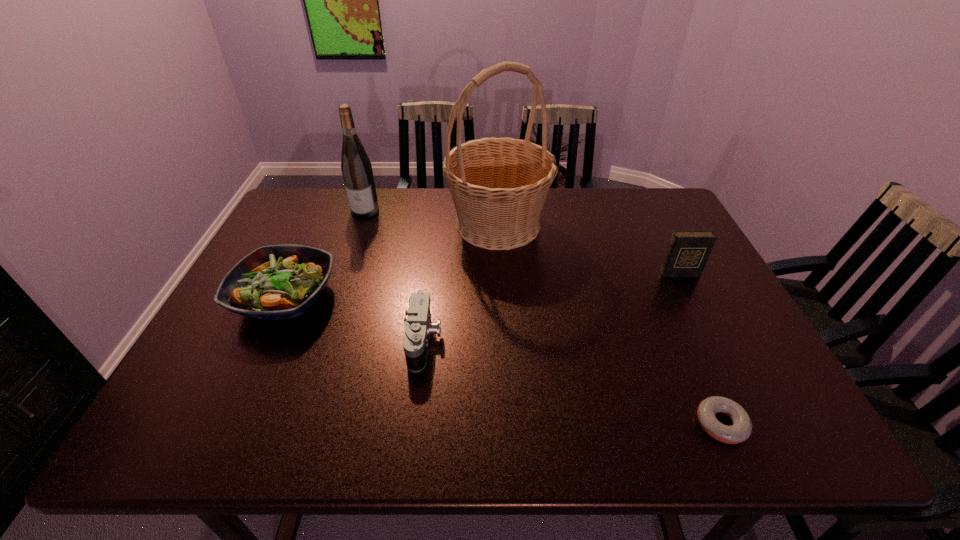
Where is `free area in between the shortest object and the fifth shortest object`? The height and width of the screenshot is (540, 960). free area in between the shortest object and the fifth shortest object is located at coordinates (543, 317).

What are the coordinates of `vacant area that lies between the fifth tallest object and the fourth tallest object` in the screenshot? It's located at (354, 320).

The height and width of the screenshot is (540, 960). In order to click on unoccupied position between the salad plate and the third tallest object in this screenshot , I will do `click(482, 286)`.

Find the location of a particular element. object that is the second closest one to the second shortest object is located at coordinates (499, 185).

Choose which object is the third nearest neighbor to the wine bottle. Please provide its 2D coordinates. Your answer should be formatted as a tuple, i.e. [(x, y)], where the tuple contains the x and y coordinates of a point satisfying the conditions above.

[(418, 327)]

Locate an element on the screen. This screenshot has height=540, width=960. vacant space that satisfies the following two spatial constraints: 1. on the back side of the salad plate; 2. on the right side of the tallest object is located at coordinates tap(320, 224).

The height and width of the screenshot is (540, 960). What are the coordinates of `vacant space that satisfies the following two spatial constraints: 1. on the back side of the doughnut; 2. on the lens of the fifth tallest object` in the screenshot? It's located at (684, 341).

The image size is (960, 540). What are the coordinates of `vacant region that satisfies the following two spatial constraints: 1. on the back side of the third shortest object; 2. on the left side of the tallest object` in the screenshot? It's located at (320, 224).

Where is `free location that satisfies the following two spatial constraints: 1. on the front side of the tallest object; 2. on the lens of the second shortest object`? free location that satisfies the following two spatial constraints: 1. on the front side of the tallest object; 2. on the lens of the second shortest object is located at coordinates (504, 341).

Locate an element on the screen. The height and width of the screenshot is (540, 960). free spot that satisfies the following two spatial constraints: 1. on the front cover of the fourth shortest object; 2. on the lens of the fifth tallest object is located at coordinates (713, 341).